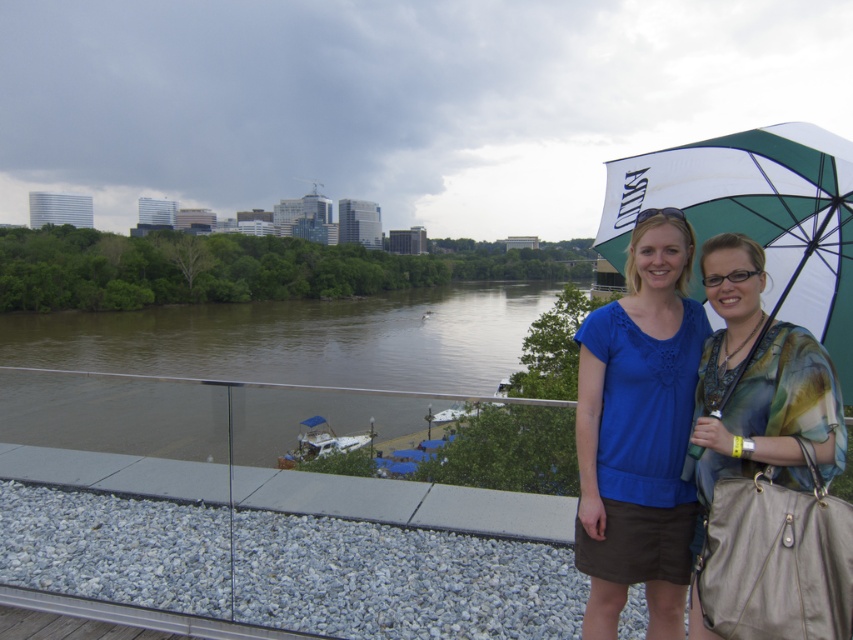
Between blue fabric shirt at center and green and white fabric umbrella at upper right, which one has less height?

Standing shorter between the two is green and white fabric umbrella at upper right.

Is blue fabric shirt at center shorter than green and white fabric umbrella at upper right?

In fact, blue fabric shirt at center may be taller than green and white fabric umbrella at upper right.

Locate an element on the screen. blue fabric shirt at center is located at coordinates (637, 433).

Which is more to the right, multicolored fabric shirt at center or blue fabric shirt at center?

Positioned to the right is multicolored fabric shirt at center.

Does multicolored fabric shirt at center appear under blue fabric shirt at center?

Incorrect, multicolored fabric shirt at center is not positioned below blue fabric shirt at center.

Identify the location of multicolored fabric shirt at center. The image size is (853, 640). (766, 472).

Locate an element on the screen. multicolored fabric shirt at center is located at coordinates (766, 472).

Can you confirm if brown water at lower left is thinner than blue fabric shirt at center?

No, brown water at lower left is not thinner than blue fabric shirt at center.

Based on the photo, can you confirm if brown water at lower left is positioned to the left of blue fabric shirt at center?

Correct, you'll find brown water at lower left to the left of blue fabric shirt at center.

Is point (132, 394) positioned before point (624, 451)?

No, it is not.

The image size is (853, 640). Find the location of `brown water at lower left`. brown water at lower left is located at coordinates (299, 378).